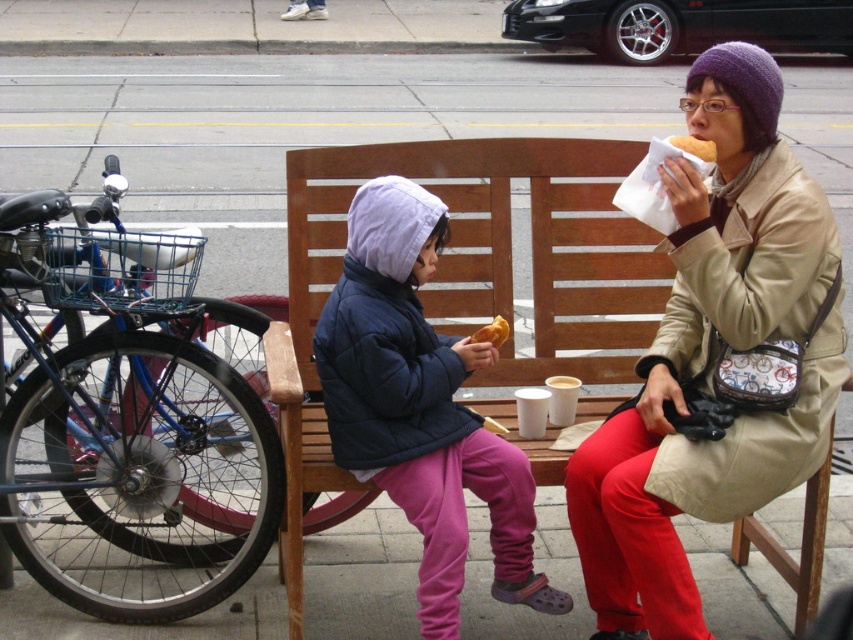
Question: Which point is closer to the camera?

Choices:
 (A) (276, 324)
 (B) (653, 595)
 (C) (703, 141)
 (D) (518, 464)

Answer: (B)

Question: Is wooden bench at center positioned behind golden bread at upper center?

Choices:
 (A) yes
 (B) no

Answer: (B)

Question: Where is golden bread at upper center located in relation to golden bread at center in the image?

Choices:
 (A) below
 (B) above

Answer: (B)

Question: Among these objects, which one is farthest from the camera?

Choices:
 (A) wooden bench at center
 (B) golden bread at upper center
 (C) beige leather jacket at center

Answer: (B)

Question: Does matte blue jacket at center appear over golden bread at upper center?

Choices:
 (A) yes
 (B) no

Answer: (B)

Question: Which point is farther from the camera taking this photo?

Choices:
 (A) (665, 284)
 (B) (500, 326)
 (C) (819, 336)
 (D) (437, 413)

Answer: (A)